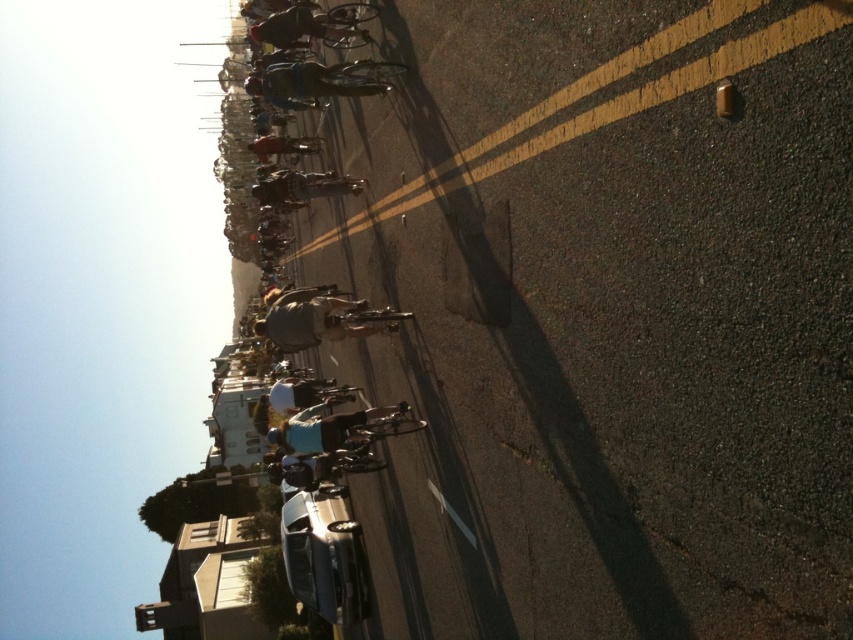
Question: Is yellow asphalt road at center to the left of metallic silver car at center from the viewer's perspective?

Choices:
 (A) no
 (B) yes

Answer: (A)

Question: Can you confirm if yellow asphalt road at center is positioned to the right of metallic silver car at center?

Choices:
 (A) yes
 (B) no

Answer: (A)

Question: Is yellow asphalt road at center further to the viewer compared to metallic silver car at center?

Choices:
 (A) yes
 (B) no

Answer: (B)